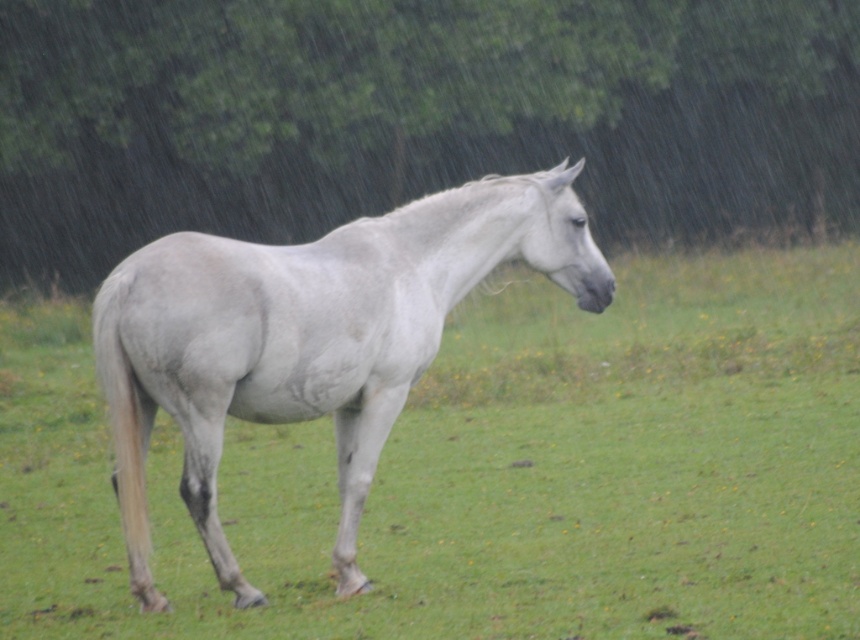
You are standing in the field and see two points in the image. Which point is closer to you, point (x=680, y=198) or point (x=280, y=257)?

Point (x=680, y=198) is further to the viewer than point (x=280, y=257), so point (x=280, y=257) is closer to you.

You are a photographer trying to capture the gray matte horse at center and the green leafy tree at upper center in a single frame. Which object should you focus on first if you want to ensure both are in focus?

The green leafy tree at upper center is bigger than the gray matte horse at center, so focusing on the tree first will help ensure both are in focus as it occupies more space in the frame.

You are standing in the grassy field where the white horse is located. You notice a point at coordinate (x=415, y=116). What object is located at that point?

The point at coordinate (x=415, y=116) corresponds to the green leafy tree at upper center.